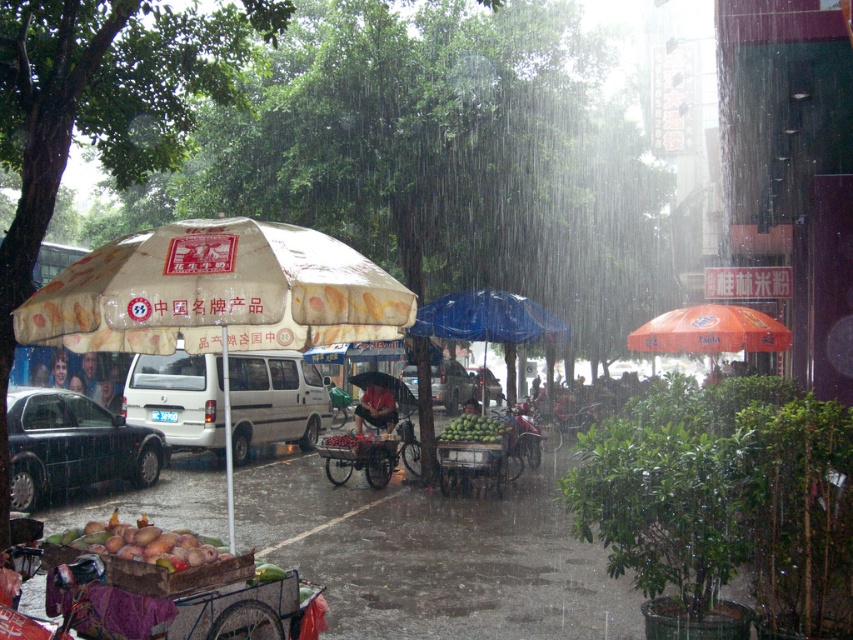
Is point (28, 392) farther from viewer compared to point (433, 385)?

No.

Looking at this image, can you confirm if shiny black sedan at left is positioned below metallic silver van at center?

Incorrect, shiny black sedan at left is not positioned below metallic silver van at center.

The image size is (853, 640). Find the location of `shiny black sedan at left`. shiny black sedan at left is located at coordinates (73, 445).

At what (x,y) coordinates should I click in order to perform the action: click on shiny black sedan at left. Please return your answer as a coordinate pair (x, y). Looking at the image, I should click on (73, 445).

Between shiny black sedan at left and blonde hair at center, which one has more height?

shiny black sedan at left is taller.

Does shiny black sedan at left have a greater width compared to blonde hair at center?

Correct, the width of shiny black sedan at left exceeds that of blonde hair at center.

Is point (91, 403) closer to viewer compared to point (57, 376)?

Yes, point (91, 403) is in front of point (57, 376).

Identify the location of shiny black sedan at left. (73, 445).

Is point (741, 316) positioned in front of point (453, 426)?

Yes, it is in front of point (453, 426).

Between orange fabric umbrella at right and green matte mangoes at center, which one is positioned higher?

Positioned higher is orange fabric umbrella at right.

Describe the element at coordinates (711, 332) in the screenshot. The width and height of the screenshot is (853, 640). I see `orange fabric umbrella at right` at that location.

At what (x,y) coordinates should I click in order to perform the action: click on orange fabric umbrella at right. Please return your answer as a coordinate pair (x, y). Looking at the image, I should click on (711, 332).